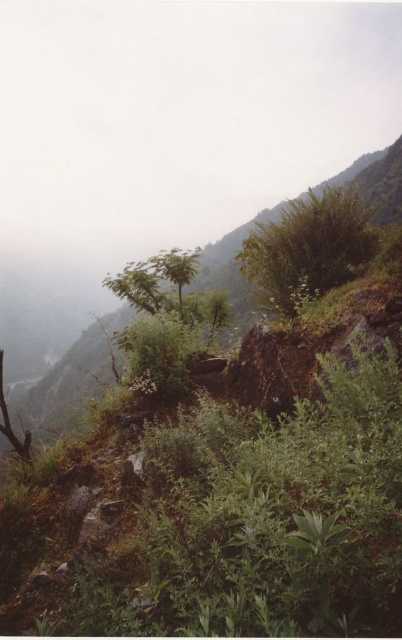
Is green leafy tree at center positioned behind green leafy tree at left?

Yes, it is behind green leafy tree at left.

Is green leafy tree at center bigger than green leafy tree at left?

No, green leafy tree at center is not bigger than green leafy tree at left.

Is point (184, 250) behind point (22, 458)?

Yes, it is.

Locate an element on the screen. The height and width of the screenshot is (640, 402). green leafy tree at center is located at coordinates (176, 268).

Consider the image. Which is more to the left, green leafy bush at center or green leafy tree at left?

From the viewer's perspective, green leafy tree at left appears more on the left side.

Is point (354, 268) positioned before point (20, 442)?

Yes, point (354, 268) is in front of point (20, 442).

Between point (293, 289) and point (2, 356), which one is positioned behind?

The point (2, 356) is more distant.

The height and width of the screenshot is (640, 402). Find the location of `green leafy bush at center`. green leafy bush at center is located at coordinates (307, 248).

Who is shorter, green leafy bush at center or green leafy tree at center?

With less height is green leafy tree at center.

Between point (328, 262) and point (188, 280), which one is positioned in front?

Point (328, 262) is more forward.

Locate an element on the screen. This screenshot has width=402, height=640. green leafy bush at center is located at coordinates (307, 248).

Locate an element on the screen. Image resolution: width=402 pixels, height=640 pixels. green leafy bush at center is located at coordinates (307, 248).